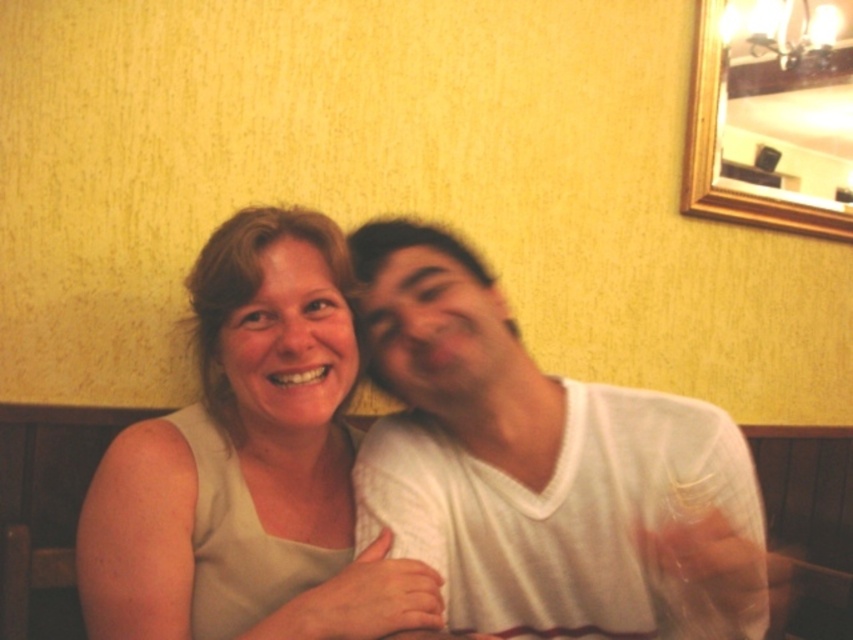
Can you confirm if matte beige blouse at center is thinner than gold wooden picture frame at upper right?

Indeed, matte beige blouse at center has a lesser width compared to gold wooden picture frame at upper right.

Who is more forward, (213, 300) or (769, 204)?

Point (213, 300) is in front.

At what (x,y) coordinates should I click in order to perform the action: click on matte beige blouse at center. Please return your answer as a coordinate pair (x, y). The image size is (853, 640). Looking at the image, I should click on (250, 460).

Between point (669, 636) and point (323, 442), which one is positioned behind?

The point (323, 442) is more distant.

Consider the image. Does white cotton shirt at center appear over matte beige blouse at center?

No.

This screenshot has width=853, height=640. What do you see at coordinates (543, 468) in the screenshot? I see `white cotton shirt at center` at bounding box center [543, 468].

I want to click on white cotton shirt at center, so click(543, 468).

Does white cotton shirt at center have a lesser height compared to gold wooden picture frame at upper right?

Yes.

Does white cotton shirt at center have a greater height compared to gold wooden picture frame at upper right?

No.

Who is more forward, (399, 355) or (714, 156)?

Point (399, 355) is in front.

Identify the location of white cotton shirt at center. (543, 468).